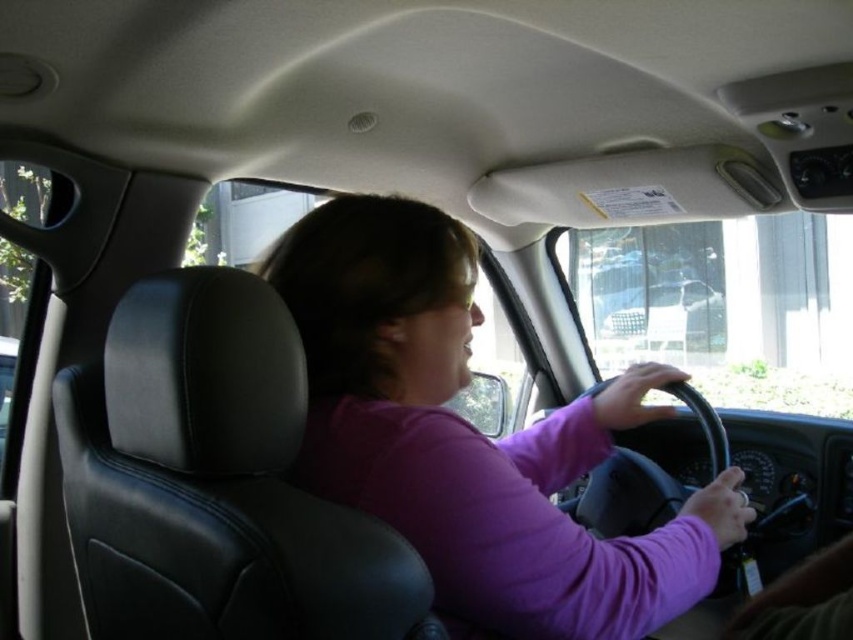
Question: Can you confirm if purple matte shirt at center is positioned above metallic silver car at center?

Choices:
 (A) yes
 (B) no

Answer: (B)

Question: Is the position of purple matte shirt at center less distant than that of metallic silver car at center?

Choices:
 (A) no
 (B) yes

Answer: (B)

Question: Which object is closer to the camera taking this photo?

Choices:
 (A) metallic silver car at center
 (B) purple matte shirt at center

Answer: (B)

Question: Which point is closer to the camera?

Choices:
 (A) purple matte shirt at center
 (B) metallic silver car at center

Answer: (A)

Question: In this image, where is purple matte shirt at center located relative to metallic silver car at center?

Choices:
 (A) below
 (B) above

Answer: (A)